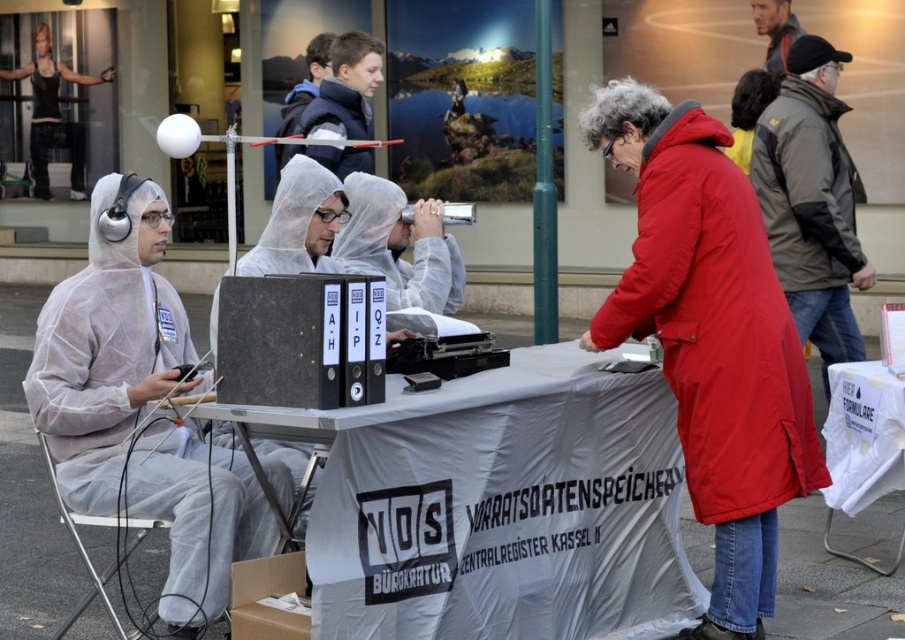
This screenshot has height=640, width=905. Describe the element at coordinates (499, 506) in the screenshot. I see `white plastic table at center` at that location.

Is white plastic table at center positioned at the back of red matte coat at center?

No, it is not.

This screenshot has width=905, height=640. In order to click on white plastic table at center in this screenshot , I will do `click(499, 506)`.

In order to click on white plastic table at center in this screenshot , I will do `click(499, 506)`.

Can you confirm if dark gray jacket at right is positioned below blonde hair at upper center?

Indeed, dark gray jacket at right is positioned under blonde hair at upper center.

Which of these two, dark gray jacket at right or blonde hair at upper center, stands shorter?

Standing shorter between the two is blonde hair at upper center.

Which is behind, point (854, 268) or point (782, 3)?

The point (782, 3) is more distant.

Locate an element on the screen. This screenshot has height=640, width=905. dark gray jacket at right is located at coordinates point(812,202).

The width and height of the screenshot is (905, 640). Describe the element at coordinates (499, 506) in the screenshot. I see `white plastic table at center` at that location.

Is white plastic table at center wider than dark gray jacket at right?

Indeed, white plastic table at center has a greater width compared to dark gray jacket at right.

This screenshot has width=905, height=640. Describe the element at coordinates (499, 506) in the screenshot. I see `white plastic table at center` at that location.

This screenshot has height=640, width=905. I want to click on white plastic table at center, so click(499, 506).